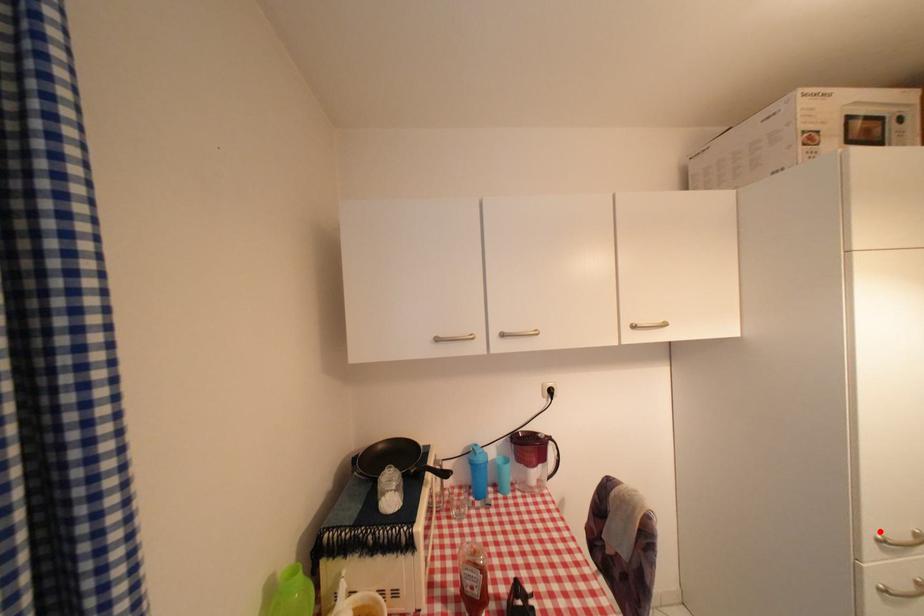
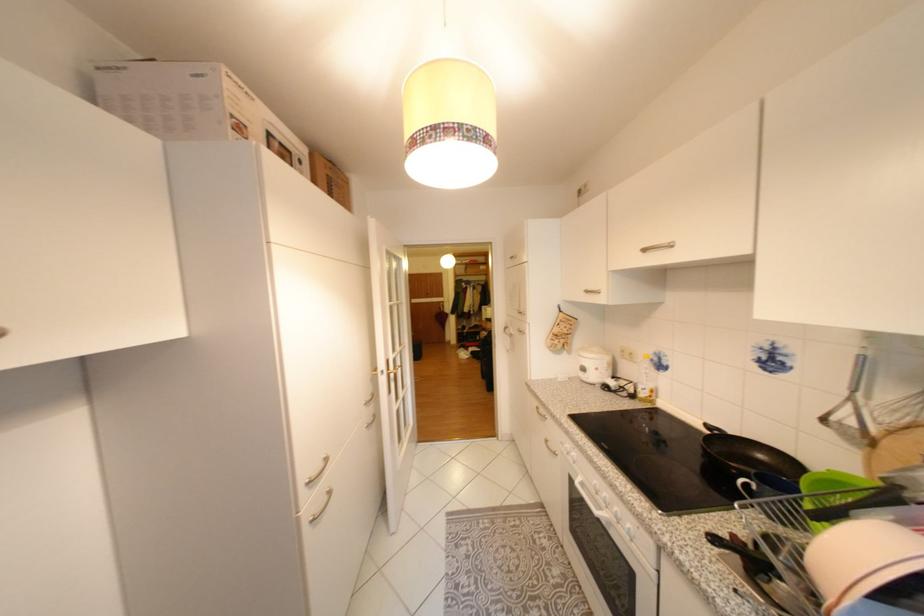
Question: I am providing you with two images of the same scene from different viewpoints. Given a red point in image1, look at the same physical point in image2. Is it:

Choices:
 (A) Closer to the viewpoint
 (B) Farther from the viewpoint

Answer: (B)